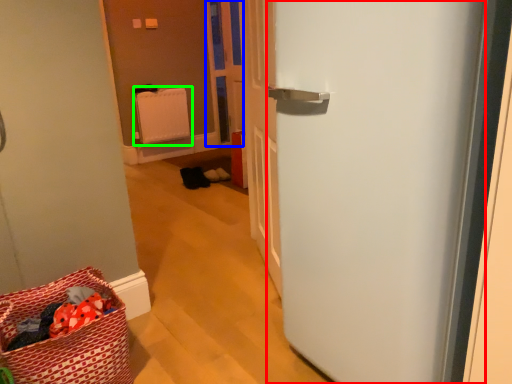
Question: Which object is the closest to the door (highlighted by a red box)? Choose among these: screen door (highlighted by a blue box) or radiator (highlighted by a green box).

Choices:
 (A) screen door
 (B) radiator

Answer: (A)